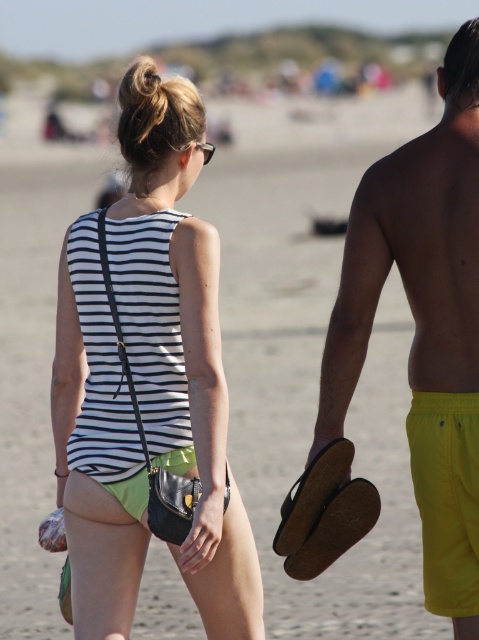
Is striped fabric tank top at center wider than yellow fabric shorts at right?

Yes, striped fabric tank top at center is wider than yellow fabric shorts at right.

Between striped fabric tank top at center and yellow fabric shorts at right, which one is positioned lower?

striped fabric tank top at center is below.

Between point (139, 282) and point (376, 285), which one is positioned in front?

Point (376, 285)

Image resolution: width=479 pixels, height=640 pixels. In order to click on striped fabric tank top at center in this screenshot , I will do `click(180, 339)`.

Which is more to the right, striped fabric tank top at center or clear plastic goggles at upper center?

Positioned to the right is clear plastic goggles at upper center.

Between point (145, 428) and point (180, 147), which one is positioned behind?

Point (180, 147)

You are a GUI agent. You are given a task and a screenshot of the screen. Output one action in this format:
    pyautogui.click(x=<x>, y=<y>)
    Task: Click on the striped fabric tank top at center
    The width and height of the screenshot is (479, 640).
    Given the screenshot: What is the action you would take?
    pyautogui.click(x=180, y=339)

Does yellow fabric shorts at right have a greater height compared to clear plastic goggles at upper center?

Correct, yellow fabric shorts at right is much taller as clear plastic goggles at upper center.

Does yellow fabric shorts at right come in front of clear plastic goggles at upper center?

That is False.

Does point (351, 209) come farther from viewer compared to point (204, 145)?

No, it is in front of (204, 145).

The image size is (479, 640). In order to click on yellow fabric shorts at right in this screenshot , I will do `click(424, 323)`.